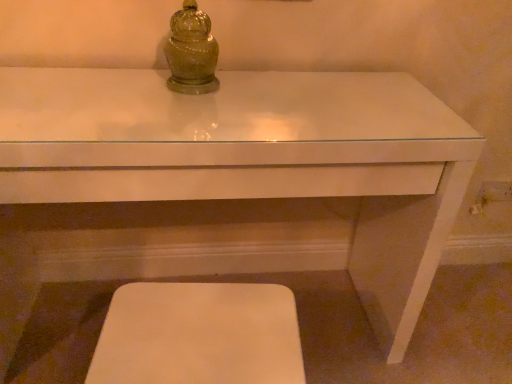
This screenshot has width=512, height=384. Identify the location of space that is in front of green glass jar at upper center. (176, 110).